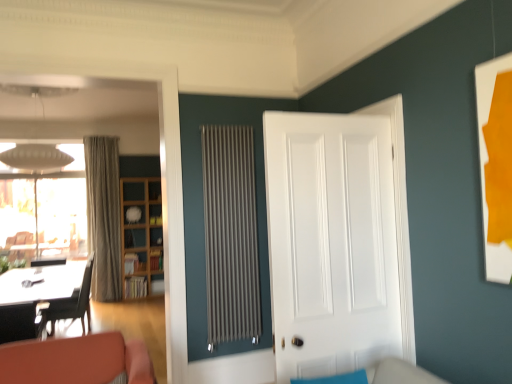
Question: Does black leather chair at left have a lesser width compared to beige textured curtain at left?

Choices:
 (A) no
 (B) yes

Answer: (A)

Question: Considering the relative sizes of black leather chair at left and beige textured curtain at left in the image provided, is black leather chair at left wider than beige textured curtain at left?

Choices:
 (A) no
 (B) yes

Answer: (B)

Question: Is black leather chair at left facing away from beige textured curtain at left?

Choices:
 (A) yes
 (B) no

Answer: (B)

Question: Is black leather chair at left placed right next to beige textured curtain at left?

Choices:
 (A) yes
 (B) no

Answer: (B)

Question: From a real-world perspective, is black leather chair at left located beneath beige textured curtain at left?

Choices:
 (A) no
 (B) yes

Answer: (B)

Question: From a real-world perspective, is transparent glass window at upper left above or below black leather chair at left?

Choices:
 (A) below
 (B) above

Answer: (B)

Question: Does point (48, 185) appear closer or farther from the camera than point (47, 314)?

Choices:
 (A) closer
 (B) farther

Answer: (B)

Question: Looking at the image, does transparent glass window at upper left seem bigger or smaller compared to black leather chair at left?

Choices:
 (A) small
 (B) big

Answer: (B)

Question: Based on their positions, is transparent glass window at upper left located to the left or right of black leather chair at left?

Choices:
 (A) right
 (B) left

Answer: (B)

Question: Considering the relative positions of matte gray radiator at center and black leather chair at left in the image provided, is matte gray radiator at center to the left or to the right of black leather chair at left?

Choices:
 (A) left
 (B) right

Answer: (B)

Question: Would you say matte gray radiator at center is inside or outside black leather chair at left?

Choices:
 (A) outside
 (B) inside

Answer: (A)

Question: Is matte gray radiator at center bigger or smaller than black leather chair at left?

Choices:
 (A) small
 (B) big

Answer: (A)

Question: Considering the positions of matte gray radiator at center and black leather chair at left in the image, is matte gray radiator at center wider or thinner than black leather chair at left?

Choices:
 (A) thin
 (B) wide

Answer: (A)

Question: Is white glossy picture frame at right in front of or behind white smooth door at center in the image?

Choices:
 (A) front
 (B) behind

Answer: (A)

Question: From a real-world perspective, relative to white smooth door at center, is white glossy picture frame at right vertically above or below?

Choices:
 (A) below
 (B) above

Answer: (B)